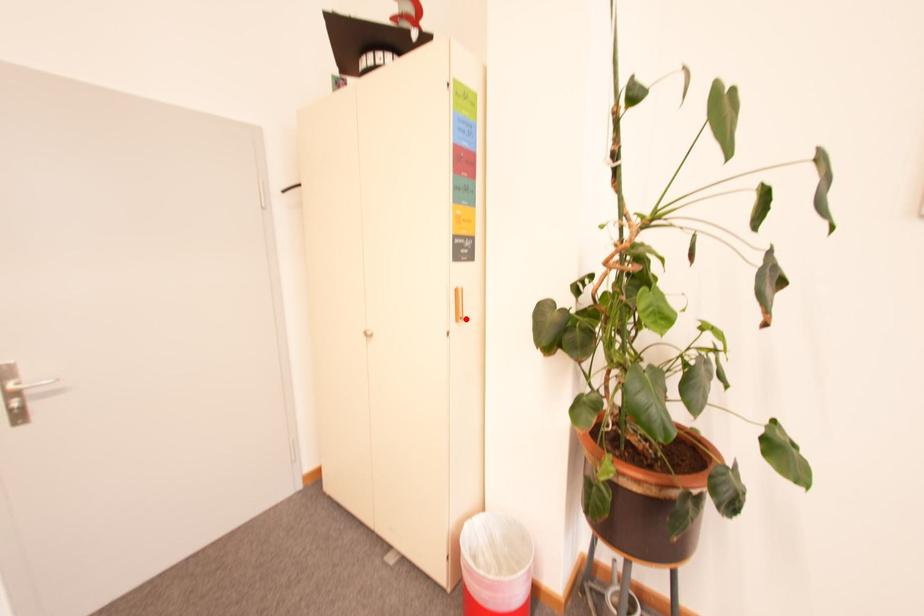
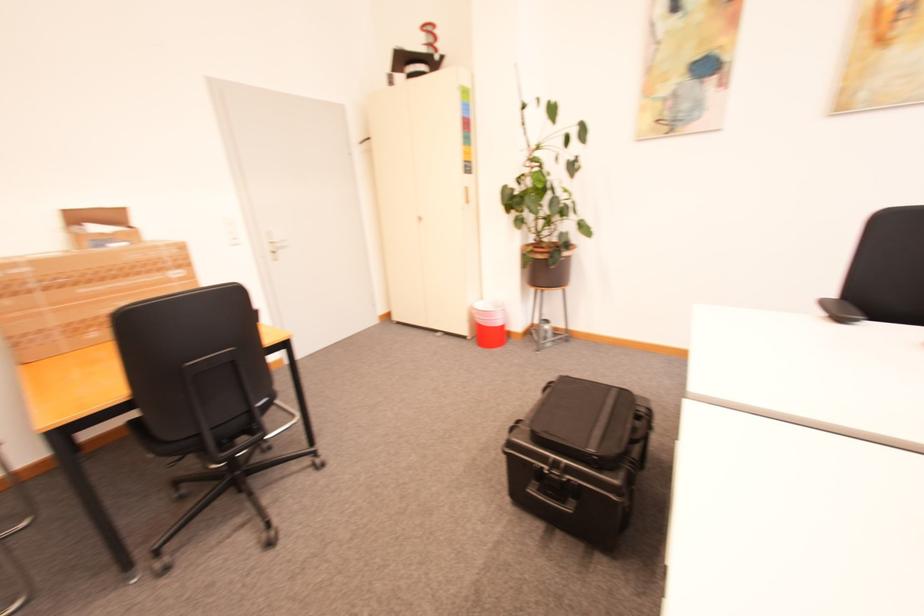
In the second image, find the point that corresponds to the highlighted location in the first image.

(473, 203)